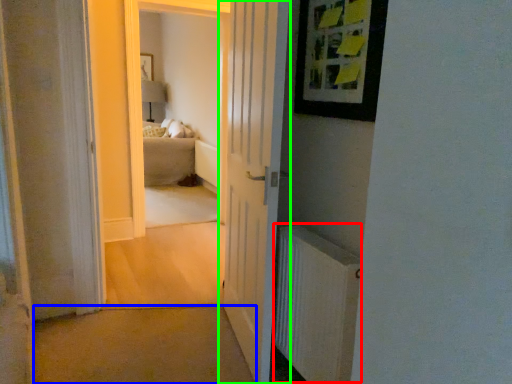
Question: Based on their relative distances, which object is nearer to radiator (highlighted by a red box)? Choose from path (highlighted by a blue box) and door (highlighted by a green box).

Choices:
 (A) path
 (B) door

Answer: (B)